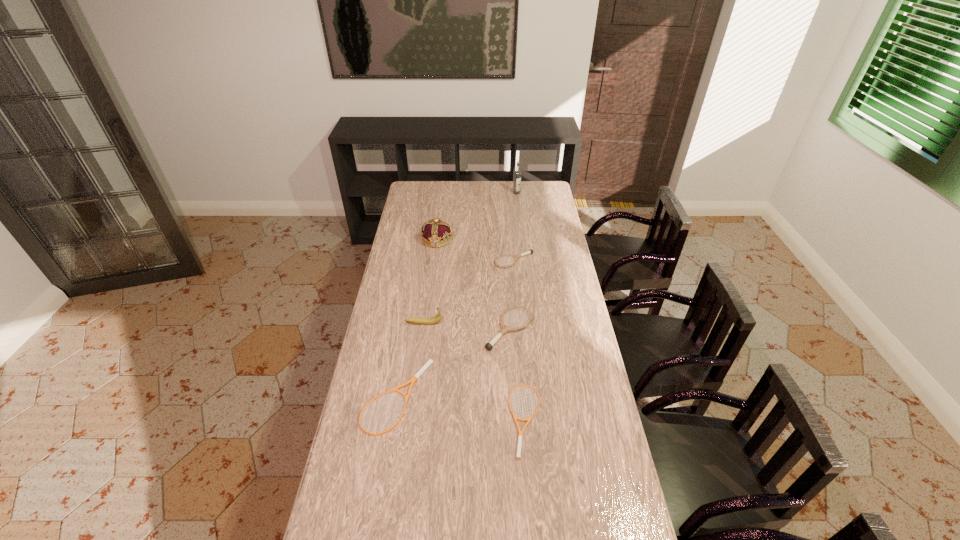
The height and width of the screenshot is (540, 960). I want to click on blank space located 0.230m on the left of the shortest tennis racket, so click(441, 420).

At what (x,y) coordinates should I click in order to perform the action: click on object present at the far edge. Please return your answer as a coordinate pair (x, y). This screenshot has height=540, width=960. Looking at the image, I should click on (517, 174).

Where is `crown present at the left edge`? crown present at the left edge is located at coordinates (436, 233).

In order to click on banana that is at the left edge in this screenshot , I will do `click(424, 321)`.

At what (x,y) coordinates should I click in order to perform the action: click on tennis racket located at the left edge. Please return your answer as a coordinate pair (x, y). Image resolution: width=960 pixels, height=540 pixels. Looking at the image, I should click on (423, 369).

Image resolution: width=960 pixels, height=540 pixels. Identify the location of free space at the far edge. (505, 195).

You are a GUI agent. You are given a task and a screenshot of the screen. Output one action in this format:
    pyautogui.click(x=<x>, y=<y>)
    Task: Click on the vacant space at the left edge of the desktop
    This screenshot has height=540, width=960.
    Given the screenshot: What is the action you would take?
    pyautogui.click(x=414, y=306)

I want to click on vacant space at the right edge of the desktop, so click(x=574, y=394).

Identify the location of vacant area at the far right corner of the desktop. This screenshot has width=960, height=540. (533, 187).

Find the location of `unoccupied area between the fifth shortest object and the purple crown`. unoccupied area between the fifth shortest object and the purple crown is located at coordinates (430, 281).